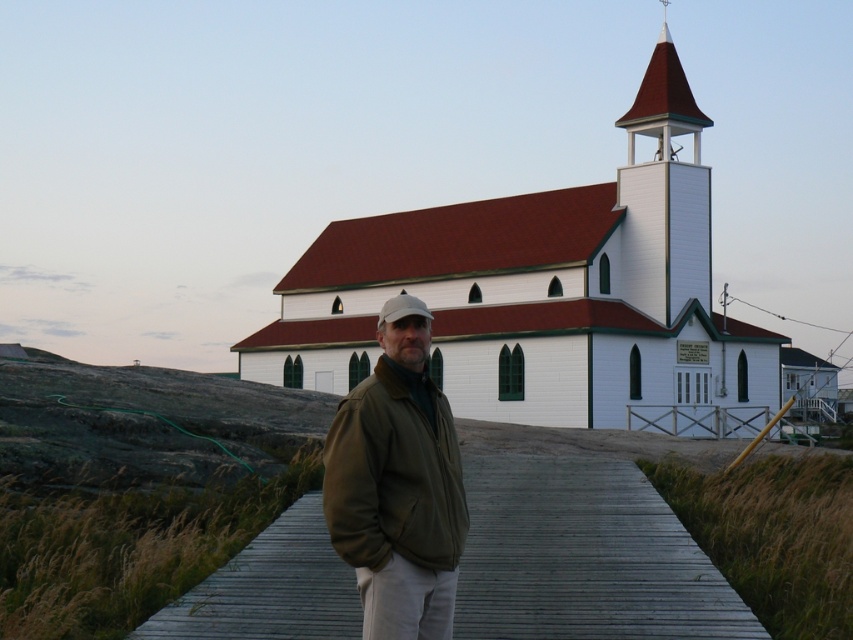
Question: Based on their relative distances, which object is nearer to the white wood spire at upper right?

Choices:
 (A) wooden at center
 (B) matte brown jacket at center
 (C) white wood church at center

Answer: (C)

Question: Estimate the real-world distances between objects in this image. Which object is closer to the white wood church at center?

Choices:
 (A) white wood spire at upper right
 (B) wooden at center

Answer: (A)

Question: Considering the relative positions of white wood church at center and wooden at center in the image provided, where is white wood church at center located with respect to wooden at center?

Choices:
 (A) above
 (B) below

Answer: (A)

Question: Which point appears closest to the camera in this image?

Choices:
 (A) (413, 230)
 (B) (657, 138)
 (C) (424, 634)
 (D) (515, 502)

Answer: (C)

Question: Does white wood church at center have a larger size compared to matte brown jacket at center?

Choices:
 (A) no
 (B) yes

Answer: (B)

Question: Is matte brown jacket at center above white wood spire at upper right?

Choices:
 (A) yes
 (B) no

Answer: (B)